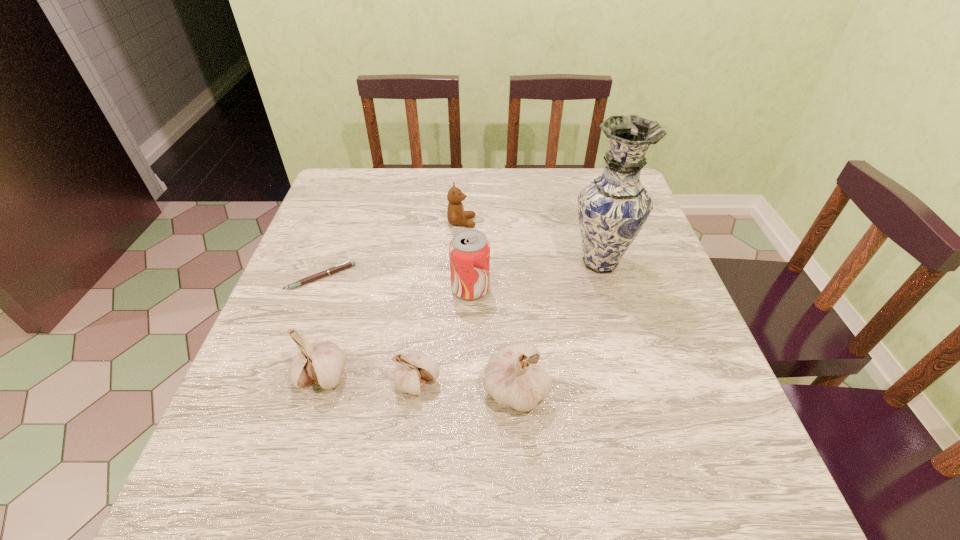
At what (x,y) coordinates should I click in order to perform the action: click on vacant area at the far edge. Please return your answer as a coordinate pair (x, y). This screenshot has height=540, width=960. Looking at the image, I should click on (564, 180).

Locate an element on the screen. vacant space at the near edge of the desktop is located at coordinates (463, 420).

You are a GUI agent. You are given a task and a screenshot of the screen. Output one action in this format:
    pyautogui.click(x=<x>, y=<y>)
    Task: Click on the vacant space at the left edge
    The height and width of the screenshot is (540, 960).
    Given the screenshot: What is the action you would take?
    pyautogui.click(x=335, y=283)

The width and height of the screenshot is (960, 540). I want to click on free space at the right edge of the desktop, so click(662, 280).

Where is `free region at the far left corner`? free region at the far left corner is located at coordinates tap(368, 175).

Find the location of `free space at the near left corner of the desktop`. free space at the near left corner of the desktop is located at coordinates (291, 403).

Find the location of `unoccupied area between the pen and the leftmost garlic`. unoccupied area between the pen and the leftmost garlic is located at coordinates (322, 326).

Locate an element on the screen. The image size is (960, 540). free spot between the tallest garlic and the soda can is located at coordinates (493, 339).

Where is `vacant area between the shortest garlic and the leftmost garlic`? The height and width of the screenshot is (540, 960). vacant area between the shortest garlic and the leftmost garlic is located at coordinates (370, 379).

The height and width of the screenshot is (540, 960). I want to click on free space between the leftmost garlic and the second garlic from right to left, so click(x=370, y=379).